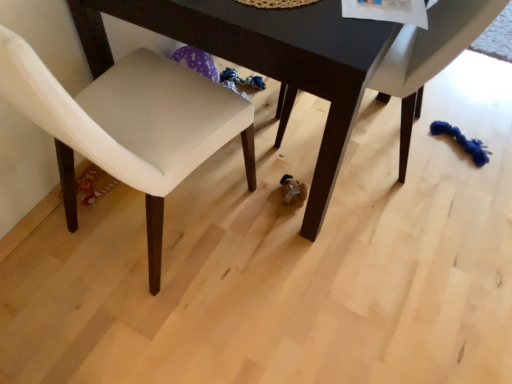
You are a GUI agent. You are given a task and a screenshot of the screen. Output one action in this format:
    pyautogui.click(x=<x>, y=<y>)
    Task: Click on the free region under white fabric chair at lower right, which is counted as the 2th chair, starting from the left (from a real-world perspective)
    The image size is (512, 384).
    Given the screenshot: What is the action you would take?
    pyautogui.click(x=392, y=142)